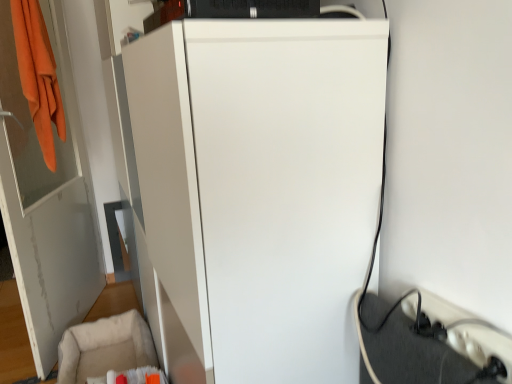
Question: From the image's perspective, is beige fabric swivel chair at lower left on white glossy door at left?

Choices:
 (A) yes
 (B) no

Answer: (B)

Question: Is beige fabric swivel chair at lower left taller than white glossy door at left?

Choices:
 (A) no
 (B) yes

Answer: (A)

Question: Does beige fabric swivel chair at lower left lie behind white glossy door at left?

Choices:
 (A) yes
 (B) no

Answer: (A)

Question: Is beige fabric swivel chair at lower left smaller than white glossy door at left?

Choices:
 (A) yes
 (B) no

Answer: (A)

Question: Is beige fabric swivel chair at lower left not inside white glossy door at left?

Choices:
 (A) no
 (B) yes

Answer: (B)

Question: Would you say beige fabric swivel chair at lower left is a long distance from white glossy door at left?

Choices:
 (A) yes
 (B) no

Answer: (B)

Question: Is white matte refrigerator at center taller than white plastic extension cord at lower right?

Choices:
 (A) yes
 (B) no

Answer: (A)

Question: From a real-world perspective, does white matte refrigerator at center stand above white plastic extension cord at lower right?

Choices:
 (A) yes
 (B) no

Answer: (A)

Question: From the image's perspective, is white matte refrigerator at center under white plastic extension cord at lower right?

Choices:
 (A) no
 (B) yes

Answer: (A)

Question: Is white matte refrigerator at center at the right side of white plastic extension cord at lower right?

Choices:
 (A) no
 (B) yes

Answer: (A)

Question: Is white matte refrigerator at center outside white plastic extension cord at lower right?

Choices:
 (A) no
 (B) yes

Answer: (B)

Question: From a real-world perspective, is white matte refrigerator at center under white plastic extension cord at lower right?

Choices:
 (A) yes
 (B) no

Answer: (B)

Question: Can you confirm if white plastic extension cord at lower right is bigger than white glossy door at left?

Choices:
 (A) no
 (B) yes

Answer: (A)